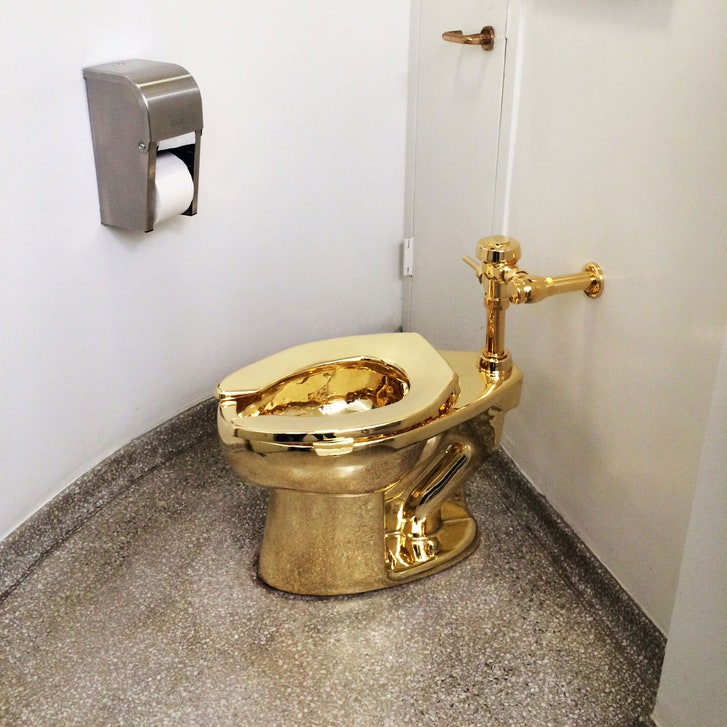
Where is `dispenser`? The height and width of the screenshot is (727, 727). dispenser is located at coordinates (174, 113).